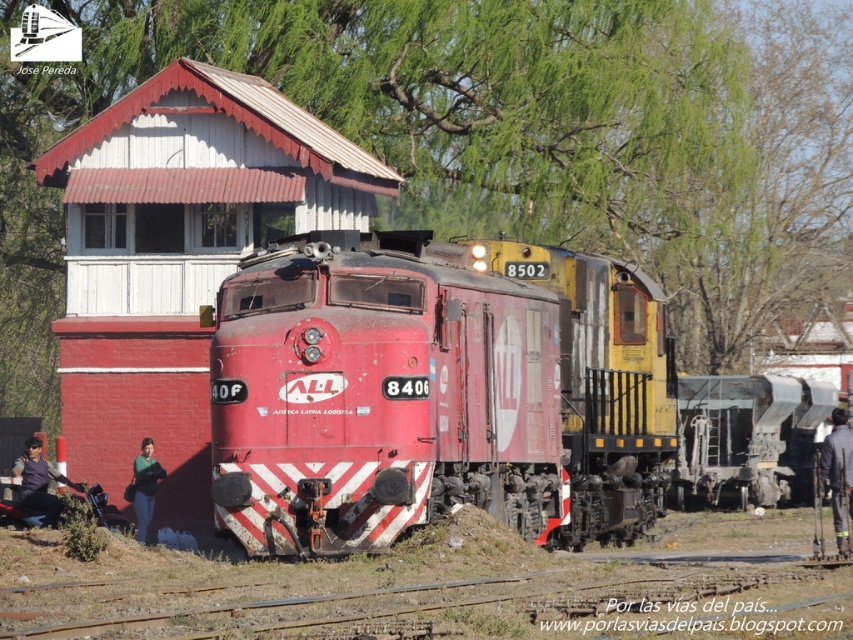
You are standing at the scene and want to move from the brick railway station at center to the dark blue fabric jacket at lower left. Which direction should you move to reach the jacket?

The brick railway station at center is positioned on the right side of dark blue fabric jacket at lower left, so you should move to the left to reach the jacket.

Consider the image. You are a passenger waiting at the brick railway station at center and notice a person wearing a green fabric shirt at lower left. Which object is closer to the ground?

The brick railway station at center is shorter than the green fabric shirt at lower left, so the brick railway station at center is closer to the ground.

You are a railway engineer assessing the scene. You need to determine the relative widths of the brick railway station at center and the green fabric shirt at lower left. Based on the image, which object is narrower?

The brick railway station at center is narrower than the green fabric shirt at lower left.